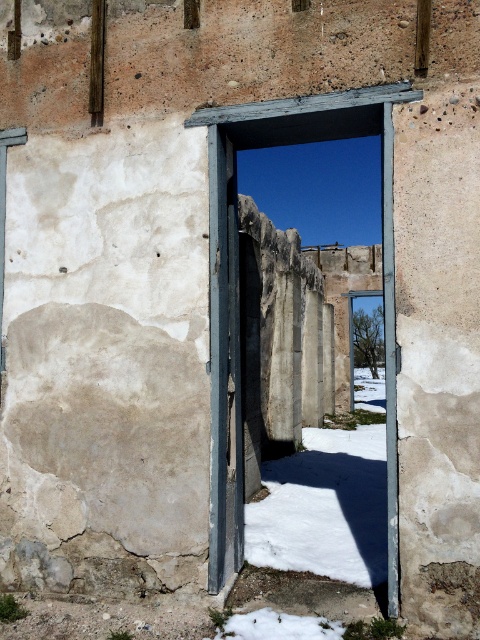
Question: Which point is closer to the camera taking this photo?

Choices:
 (A) (215, 488)
 (B) (231, 403)

Answer: (A)

Question: Where is wooden door frame at center located in relation to rusty metal door at center in the image?

Choices:
 (A) above
 (B) below

Answer: (A)

Question: Is the position of wooden door frame at center more distant than that of rusty metal door at center?

Choices:
 (A) no
 (B) yes

Answer: (A)

Question: Is wooden door frame at center below rusty metal door at center?

Choices:
 (A) no
 (B) yes

Answer: (A)

Question: Which object is closer to the camera taking this photo?

Choices:
 (A) wooden door frame at center
 (B) rusty metal door at center

Answer: (A)